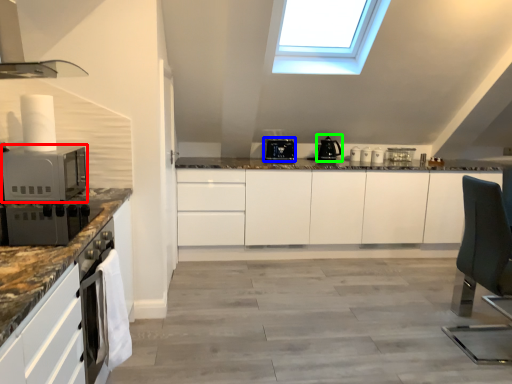
Question: Which object is positioned farthest from microwave oven (highlighted by a red box)? Select from kitchen appliance (highlighted by a blue box) and kitchen appliance (highlighted by a green box).

Choices:
 (A) kitchen appliance
 (B) kitchen appliance

Answer: (B)